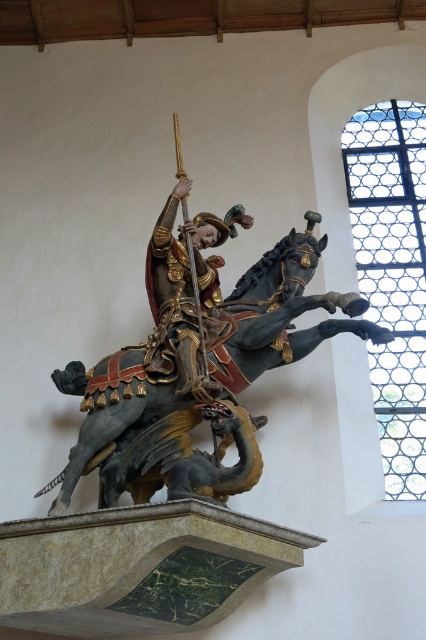
Between point (204, 396) and point (152, 253), which one is positioned behind?

The point (152, 253) is behind.

Is polished dark gray horse at center smaller than gold polished armor at center?

No.

Between point (327, 330) and point (155, 364), which one is positioned behind?

The point (327, 330) is behind.

The image size is (426, 640). In order to click on polished dark gray horse at center in this screenshot , I will do `click(196, 381)`.